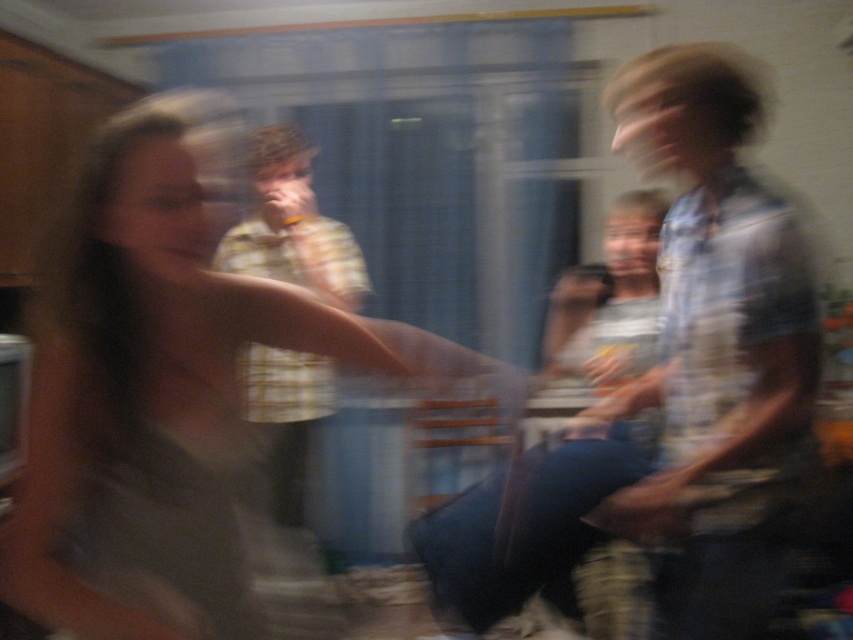
You are a photographer at this event and want to capture a clear photo of the blue striped shirt at right. The camera requires a minimum distance of 1.5 meters to focus properly. Can you take the photo from where you are standing?

The blue striped shirt at right is 1.29 meters away, which is less than the required 1.5 meters. Therefore, you cannot take a clear photo from your current position.

You are a photographer trying to capture a clear photo of the matte gray tank top at center and the blue striped shirt at right. The camera can focus on objects within 20 inches. Will both subjects be in focus?

The distance between the matte gray tank top at center and the blue striped shirt at right is 19.96 inches, so yes, both subjects will be in focus since the distance is within the camera focus range of 20 inches.

You are standing at the camera position and want to take a clearer photo of the point labeled as point (721, 170). Considering the scene is currently blurred due to motion or low light, what adjustment should you make to focus on that specific point?

To focus on the point labeled as point (721, 170), which is 1.41 meters from the camera, you should adjust the camera focus to 1.41 meters distance to ensure clarity.